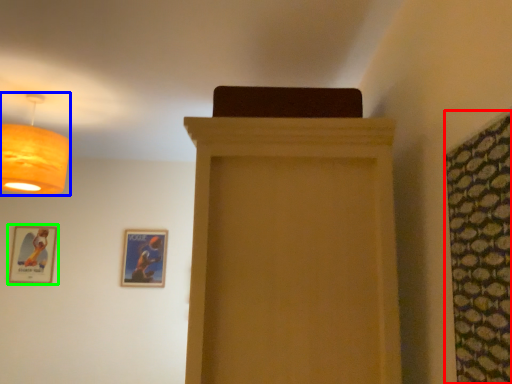
Question: Which is nearer to the curtain (highlighted by a red box)? lamp (highlighted by a blue box) or picture frame (highlighted by a green box).

Choices:
 (A) lamp
 (B) picture frame

Answer: (A)